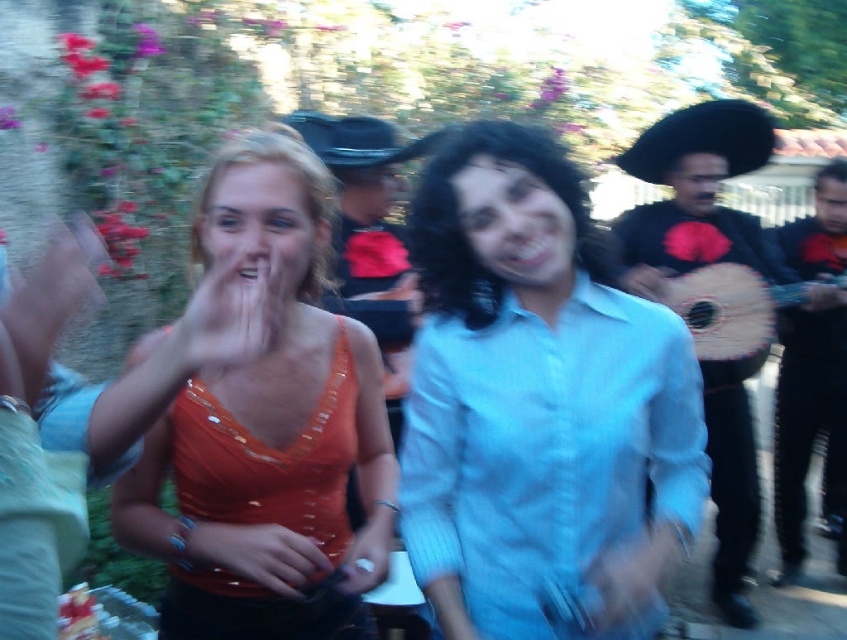
You are standing in the middle of the crowd at the event and see two points in the scene. The first point is at coordinates point (x=626, y=154) and the second point is at point (x=346, y=161). Which point is closer to you?

Point (x=346, y=161) is closer to you because it is less far from the camera than point (x=626, y=154).

In the scene shown: You are a photographer at the event. You need to decide which object, the orange sequined top at left or the black leather sombrero at right, would be easier to capture in a closeup shot without cropping. Which one should you choose?

The orange sequined top at left is thinner than the black leather sombrero at right, so it would be easier to capture in a closeup shot without cropping.